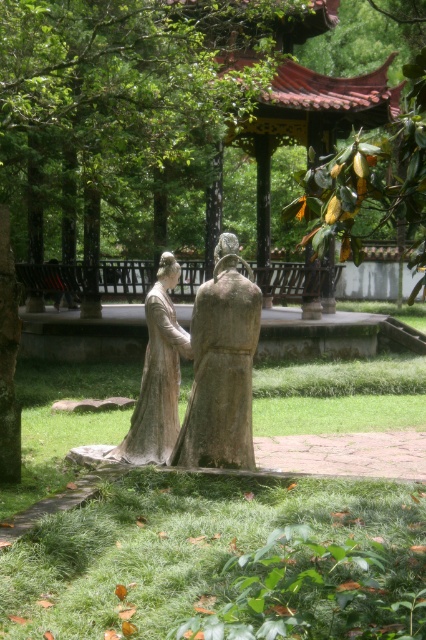
Can you confirm if matte stone statues at center is thinner than matte stone statue at center?

Incorrect, matte stone statues at center's width is not less than matte stone statue at center's.

Can you confirm if matte stone statues at center is positioned above matte stone statue at center?

Actually, matte stone statues at center is below matte stone statue at center.

Image resolution: width=426 pixels, height=640 pixels. What do you see at coordinates (213, 362) in the screenshot? I see `matte stone statues at center` at bounding box center [213, 362].

The image size is (426, 640). Identify the location of matte stone statues at center. (213, 362).